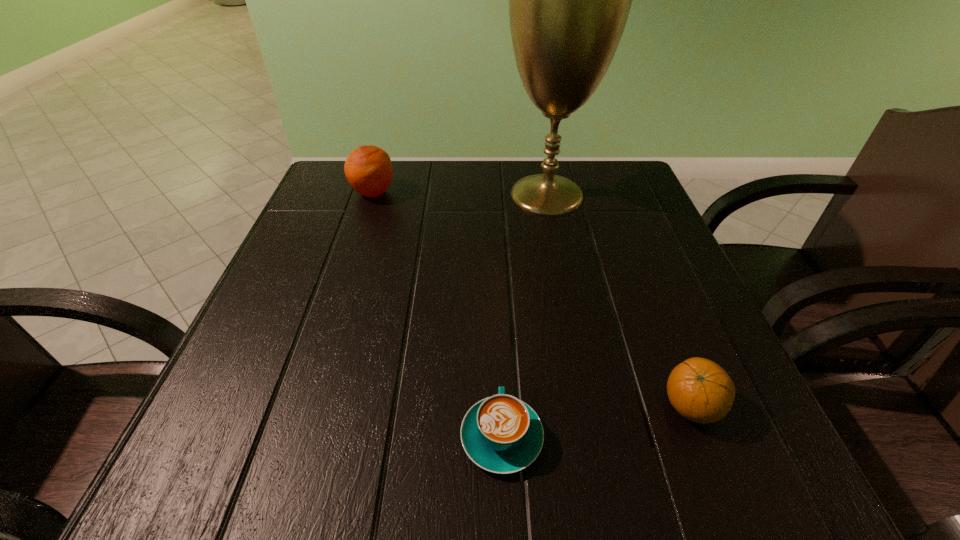
Find the location of `free space that is in between the shorter orange and the left orange`. free space that is in between the shorter orange and the left orange is located at coordinates (532, 300).

I want to click on free area in between the trophy cup and the cappuccino, so click(524, 316).

Where is `vacant point located between the left orange and the trophy cup`? vacant point located between the left orange and the trophy cup is located at coordinates (460, 193).

Where is `vacant area that lies between the nearer orange and the cappuccino`? vacant area that lies between the nearer orange and the cappuccino is located at coordinates (596, 422).

Image resolution: width=960 pixels, height=540 pixels. Identify the location of free space that is in between the cappuccino and the shorter orange. (596, 422).

Identify the location of free area in between the cappuccino and the shorter orange. (596, 422).

This screenshot has width=960, height=540. I want to click on empty space between the trophy cup and the nearer orange, so click(619, 300).

Locate an element on the screen. The image size is (960, 540). unoccupied position between the shorter orange and the left orange is located at coordinates (532, 300).

Find the location of a particular element. This screenshot has height=540, width=960. vacant space in between the trophy cup and the shortest object is located at coordinates (524, 316).

Find the location of a particular element. free space that is in between the cappuccino and the tallest object is located at coordinates (524, 316).